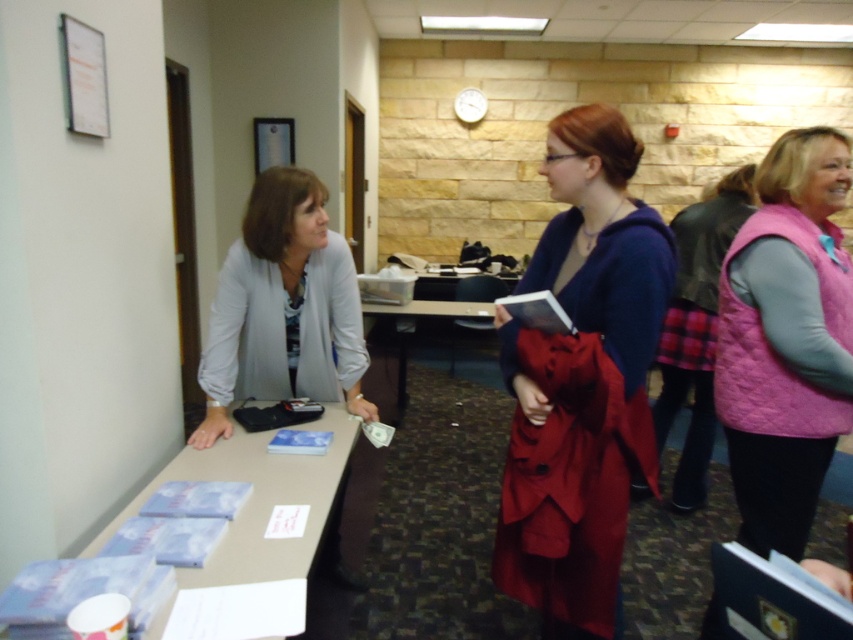
Question: Which point appears closest to the camera in this image?

Choices:
 (A) (177, 442)
 (B) (474, 323)
 (C) (776, 308)

Answer: (C)

Question: Is velvet purple coat at center below pink quilted vest at right?

Choices:
 (A) yes
 (B) no

Answer: (A)

Question: Which point appears closest to the camera in this image?

Choices:
 (A) (606, 310)
 (B) (144, 483)
 (C) (805, 198)

Answer: (A)

Question: Is velvet purple coat at center in front of pink quilted vest at right?

Choices:
 (A) no
 (B) yes

Answer: (B)

Question: Among these points, which one is farthest from the camera?

Choices:
 (A) (595, 404)
 (B) (850, 300)

Answer: (B)

Question: Is pink quilted vest at right behind wooden table at center?

Choices:
 (A) yes
 (B) no

Answer: (B)